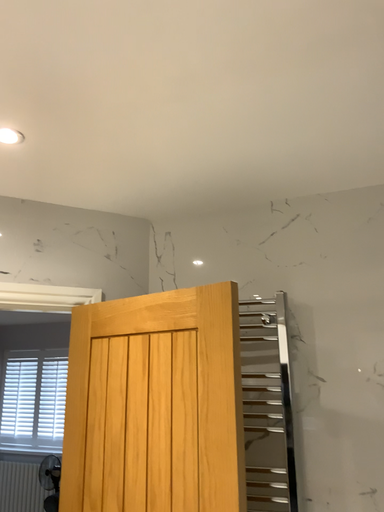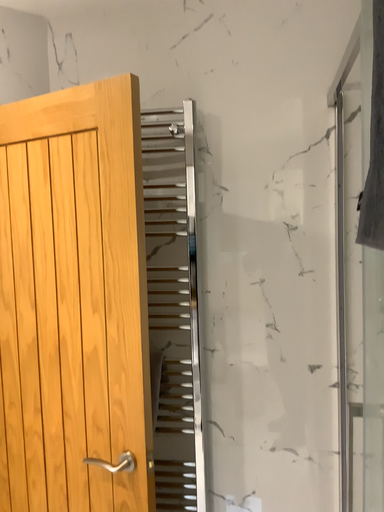
Question: How did the camera likely rotate when shooting the video?

Choices:
 (A) rotated left
 (B) rotated right

Answer: (B)